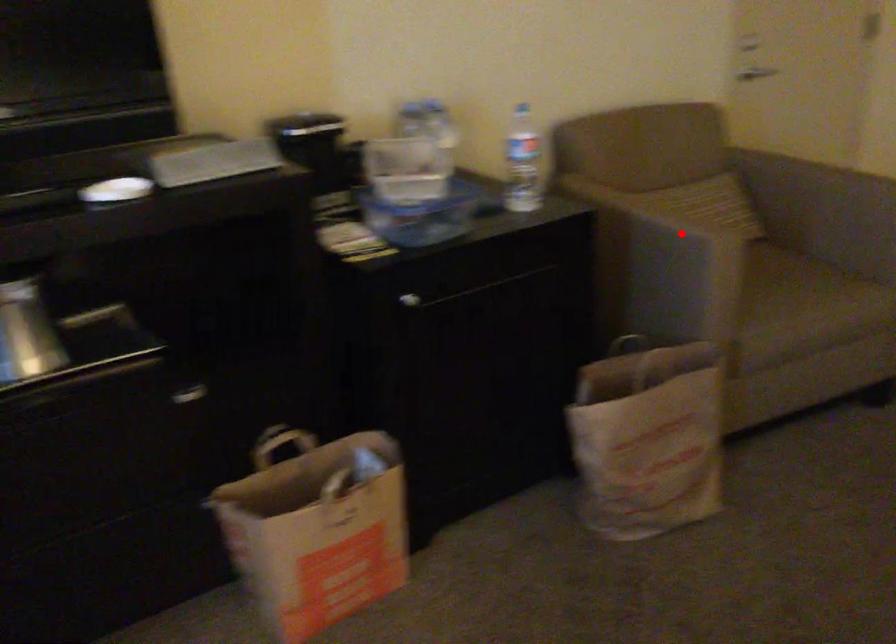
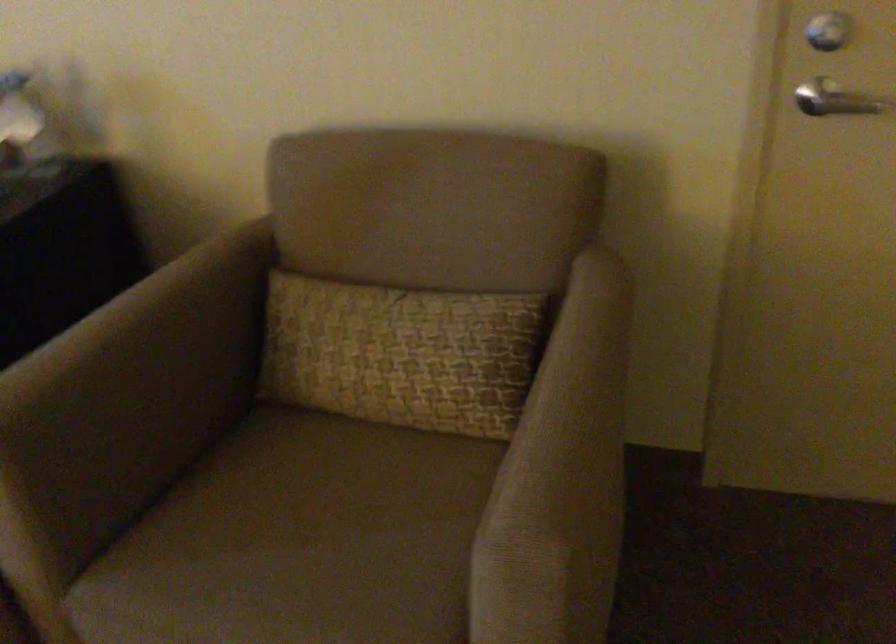
Question: A red point is marked in image1. In image2, is the corresponding 3D point closer to the camera or farther? Reply with the corresponding letter.

Choices:
 (A) The corresponding 3D point is closer.
 (B) The corresponding 3D point is farther.

Answer: (A)